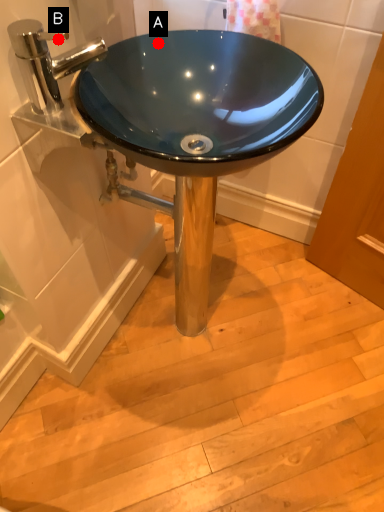
Question: Two points are circled on the image, labeled by A and B beside each circle. Which point is farther from the camera taking this photo?

Choices:
 (A) A is further
 (B) B is further

Answer: (A)